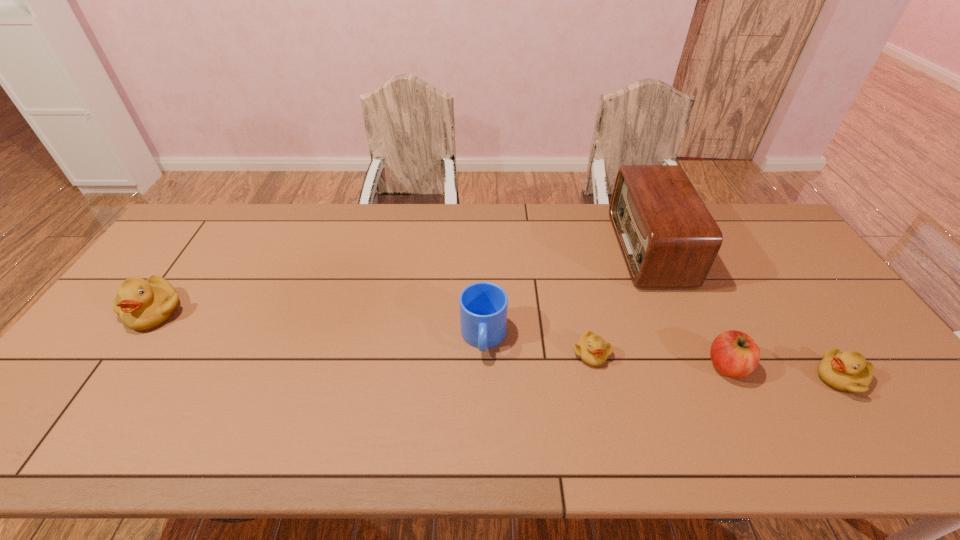
At what (x,y) coordinates should I click in order to perform the action: click on blank region between the farthest duckling and the rightmost object. Please return your answer as a coordinate pair (x, y). This screenshot has width=960, height=540. Looking at the image, I should click on (497, 345).

Locate an element on the screen. This screenshot has height=540, width=960. free space between the leftmost duckling and the second shortest duckling is located at coordinates (497, 345).

Image resolution: width=960 pixels, height=540 pixels. What are the coordinates of `free space between the tallest object and the rightmost object` in the screenshot? It's located at (745, 313).

Identify the location of vacant space that's between the radio receiver and the rightmost duckling. The image size is (960, 540). (745, 313).

Locate an element on the screen. This screenshot has height=540, width=960. free point between the fifth object from right to left and the farthest duckling is located at coordinates (320, 325).

In order to click on vacant area that lies between the shortest object and the mug in this screenshot , I will do `click(538, 346)`.

Identify the location of vacant area that lies between the radio receiver and the apple. pos(688,307).

This screenshot has width=960, height=540. What are the coordinates of `object that is the third nearest to the apple` in the screenshot? It's located at pos(592,350).

Identify which object is located as the second nearest to the rightmost duckling. Please provide its 2D coordinates. Your answer should be formatted as a tuple, i.e. [(x, y)], where the tuple contains the x and y coordinates of a point satisfying the conditions above.

[(668, 238)]

Find the location of a particular element. Image resolution: width=960 pixels, height=540 pixels. duckling that can be found as the third closest to the tallest object is located at coordinates tap(142, 304).